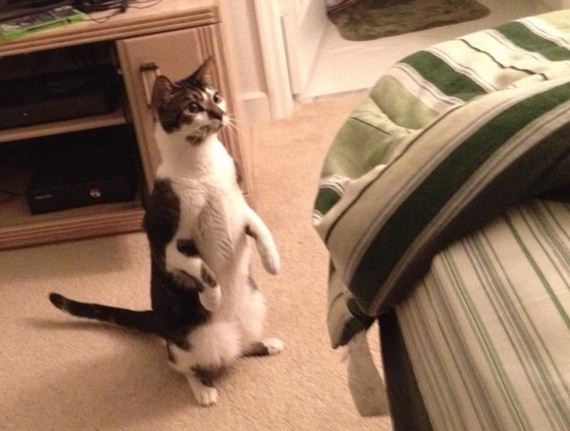
I want to click on white fur, so click(x=202, y=164).